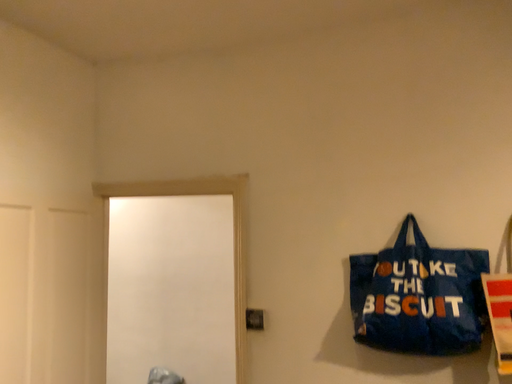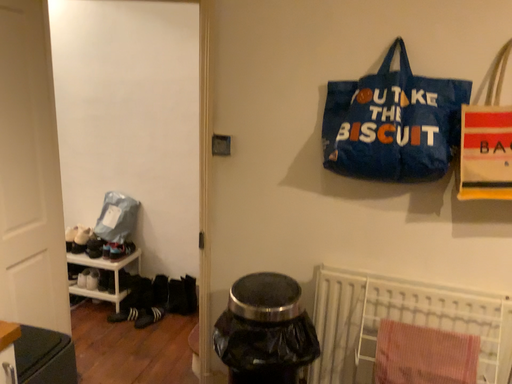
Question: How did the camera likely rotate when shooting the video?

Choices:
 (A) rotated left
 (B) rotated right

Answer: (B)